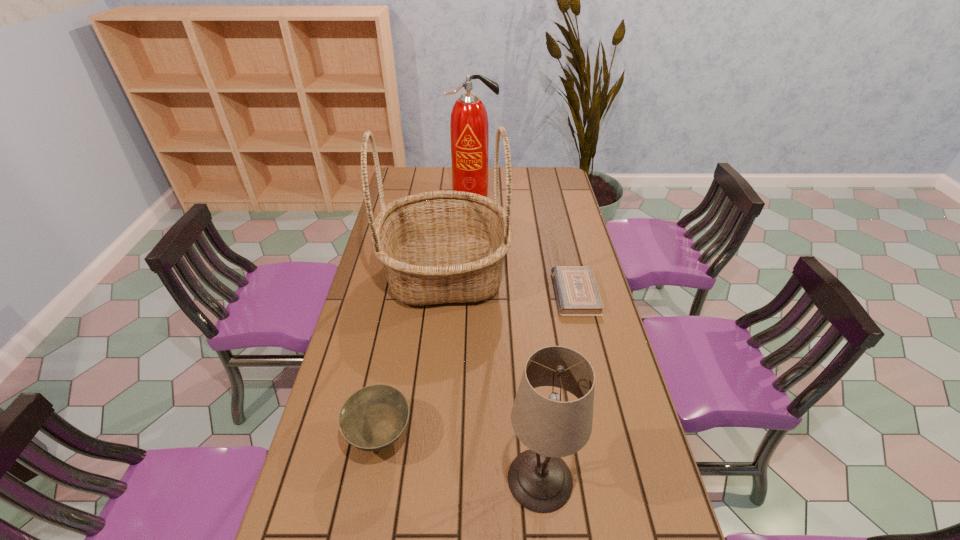
You are a GUI agent. You are given a task and a screenshot of the screen. Output one action in this format:
    pyautogui.click(x=<x>, y=<y>)
    Task: Click on the basket
    
    Given the screenshot: What is the action you would take?
    pyautogui.click(x=436, y=247)

Locate an element on the screen. This screenshot has width=960, height=540. fire extinguisher is located at coordinates (469, 129).

Where is `lampshade`? The width and height of the screenshot is (960, 540). lampshade is located at coordinates (539, 479).

Find the location of a particular element. bowl is located at coordinates (373, 418).

This screenshot has width=960, height=540. Identify the location of the rightmost object. (577, 294).

Identify the location of Bible. (577, 294).

This screenshot has width=960, height=540. I want to click on vacant space situated 0.070m on the right of the basket, so click(529, 273).

Identify the location of vacant area situated 0.050m on the back of the fire extinguisher. (473, 180).

Identify the location of free region located on the front-facing side of the third shortest object. The height and width of the screenshot is (540, 960). click(355, 479).

You are a GUI agent. You are given a task and a screenshot of the screen. Output one action in this format:
    pyautogui.click(x=<x>, y=<y>)
    Task: Click on the vacant area located on the front-facing side of the third shortest object
    
    Given the screenshot: What is the action you would take?
    pyautogui.click(x=368, y=479)